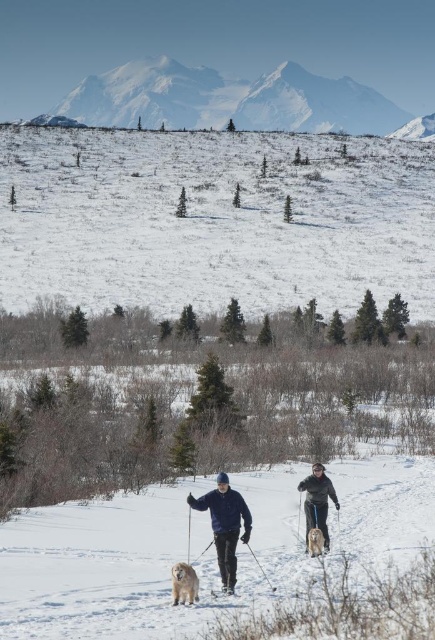
Which is in front, point (196, 97) or point (188, 564)?

Positioned in front is point (188, 564).

Image resolution: width=435 pixels, height=640 pixels. Identify the location of snowy mountain range at upper center. (228, 100).

Measure the distance between point (111, 102) and camera.

They are 1492.43 feet apart.

What are the coordinates of `snowy mountain range at upper center` in the screenshot? It's located at tap(228, 100).

Between snowy mountain range at upper center and golden fur dog at center, which one has more height?

Standing taller between the two is snowy mountain range at upper center.

Where is `snowy mountain range at upper center`? This screenshot has height=640, width=435. snowy mountain range at upper center is located at coordinates (228, 100).

Does gray fleece jacket at center have a larger size compared to golden fur dog at lower center?

Yes.

Consider the image. Which is more to the right, gray fleece jacket at center or golden fur dog at lower center?

gray fleece jacket at center is more to the right.

Who is more forward, (321,499) or (173,593)?

Point (173,593) is more forward.

The image size is (435, 640). I want to click on gray fleece jacket at center, so click(317, 500).